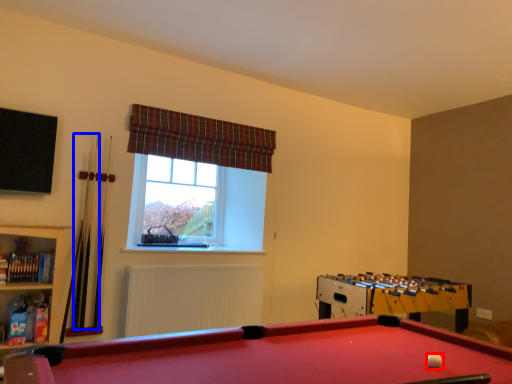
Question: Which of the following is the farthest to the observer, ball (highlighted by a red box) or cue (highlighted by a blue box)?

Choices:
 (A) ball
 (B) cue

Answer: (B)